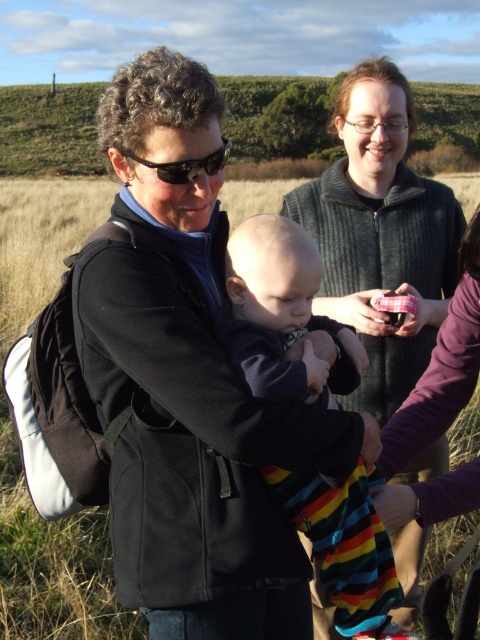
You are a photographer trying to capture a closeup shot of the knitted sweater at upper center and the striped cotton baby at center. Since you want to focus on both objects equally, which one should you position closer to the center of your camera frame?

The knitted sweater at upper center is positioned on the right side of striped cotton baby at center, so to focus on both equally, you should center the camera frame between them, ensuring both are visible and balanced.

You are a photographer trying to capture a closeup of the striped cotton baby at center and the black plastic sunglasses at center. Which object should you focus on first if you want to ensure both are in focus?

The striped cotton baby at center is located below the black plastic sunglasses at center. Since they are at different vertical positions, focusing on the middle point between them or using a small aperture for greater depth of field would help keep both in focus.